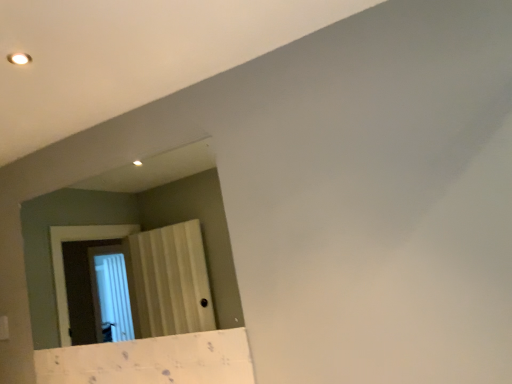
Measure the distance between matte glass mirror at center and camera.

matte glass mirror at center and camera are 2.00 meters apart.

Measure the distance between point (159, 193) and camera.

The depth of point (159, 193) is 7.19 feet.

Locate an element on the screen. matte glass mirror at center is located at coordinates (134, 223).

What is the approximate height of matte glass mirror at center?

91.64 centimeters.

This screenshot has width=512, height=384. Describe the element at coordinates (134, 223) in the screenshot. I see `matte glass mirror at center` at that location.

I want to click on matte glass mirror at center, so click(x=134, y=223).